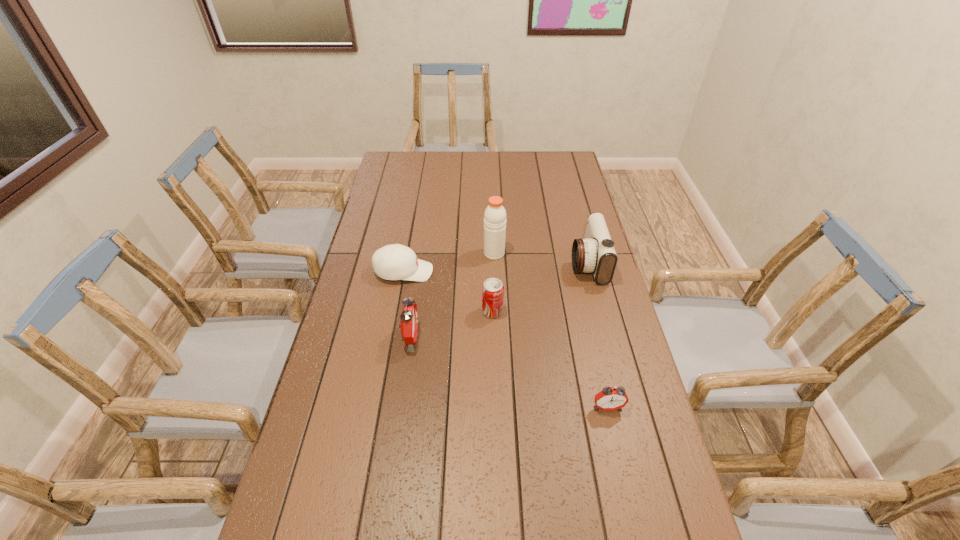
You are a GUI agent. You are given a task and a screenshot of the screen. Output one action in this format:
    pyautogui.click(x=<x>, y=<y>)
    Task: Click on the vacant space at the near edge
    The image size is (960, 540).
    Given the screenshot: What is the action you would take?
    pyautogui.click(x=464, y=532)

The height and width of the screenshot is (540, 960). In the image, there is a desktop. In order to click on vacant space at the left edge in this screenshot , I will do `click(299, 468)`.

Locate an element on the screen. The width and height of the screenshot is (960, 540). vacant space at the right edge of the desktop is located at coordinates (558, 240).

This screenshot has width=960, height=540. Find the location of `vacant region at the far right corner of the desktop`. vacant region at the far right corner of the desktop is located at coordinates (568, 153).

Where is `free space at the near right corner of the desktop`? This screenshot has height=540, width=960. free space at the near right corner of the desktop is located at coordinates (612, 505).

Identify the location of vacant space in between the fourth farthest object and the baseball cap. pyautogui.click(x=448, y=292).

This screenshot has height=540, width=960. Identify the location of free point between the nearer alarm clock and the farther alarm clock. (509, 372).

Locate an element on the screen. Image resolution: width=960 pixels, height=540 pixels. empty location between the baseball cap and the soda can is located at coordinates (448, 292).

Identify the location of free space between the shaker and the left alarm clock. This screenshot has height=540, width=960. (452, 295).

Find the location of a particular element. empty location between the fourth farthest object and the baseball cap is located at coordinates click(448, 292).